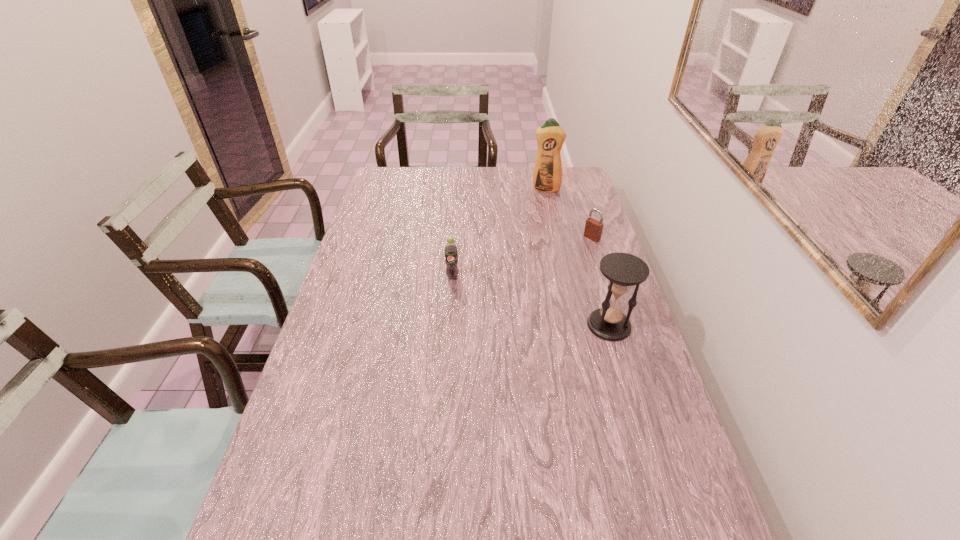
Find the location of a particular element. empty space that is in between the farthest object and the padlock is located at coordinates (568, 213).

Locate an element on the screen. This screenshot has height=540, width=960. vacant space in between the farthest object and the shortest object is located at coordinates (568, 213).

At what (x,y) coordinates should I click in order to perform the action: click on empty space between the shortest object and the hourglass. Please return your answer as a coordinate pair (x, y). The width and height of the screenshot is (960, 540). Looking at the image, I should click on (600, 281).

Find the location of a particular element. The height and width of the screenshot is (540, 960). empty space that is in between the farthest object and the nearest object is located at coordinates (577, 257).

What are the coordinates of `blank region between the leftmost object and the padlock` in the screenshot? It's located at (522, 258).

Identify the location of free area in between the second farthest object and the tallest object. (568, 213).

The image size is (960, 540). Identify the location of vacant region between the nearest object and the leftmost object. (531, 301).

I want to click on free space between the hourglass and the second farthest object, so click(x=600, y=281).

You are a GUI agent. You are given a task and a screenshot of the screen. Output one action in this format:
    pyautogui.click(x=<x>, y=<y>)
    Task: Click on the vacant area between the second nearest object and the hourglass
    
    Given the screenshot: What is the action you would take?
    [531, 301]

Locate an element on the screen. the closest object relative to the second tallest object is located at coordinates (593, 229).